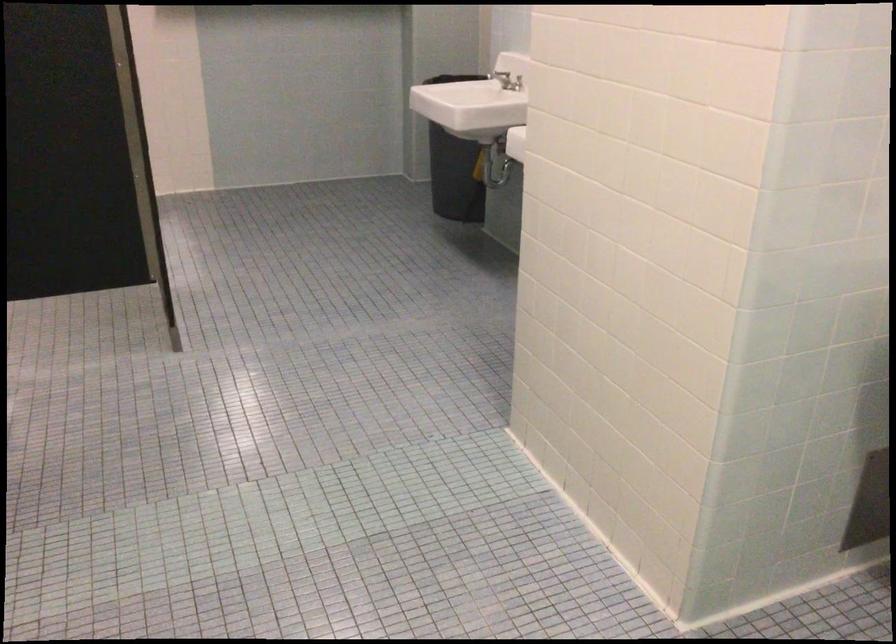
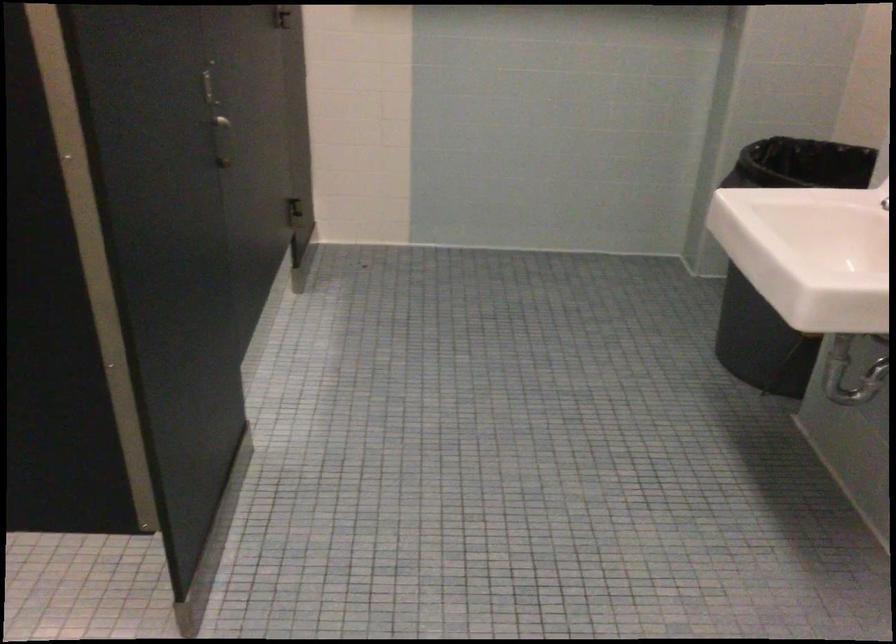
Question: The images are taken continuously from a first-person perspective. In which direction are you moving?

Choices:
 (A) Left
 (B) Right
 (C) Forward
 (D) Backward

Answer: (C)